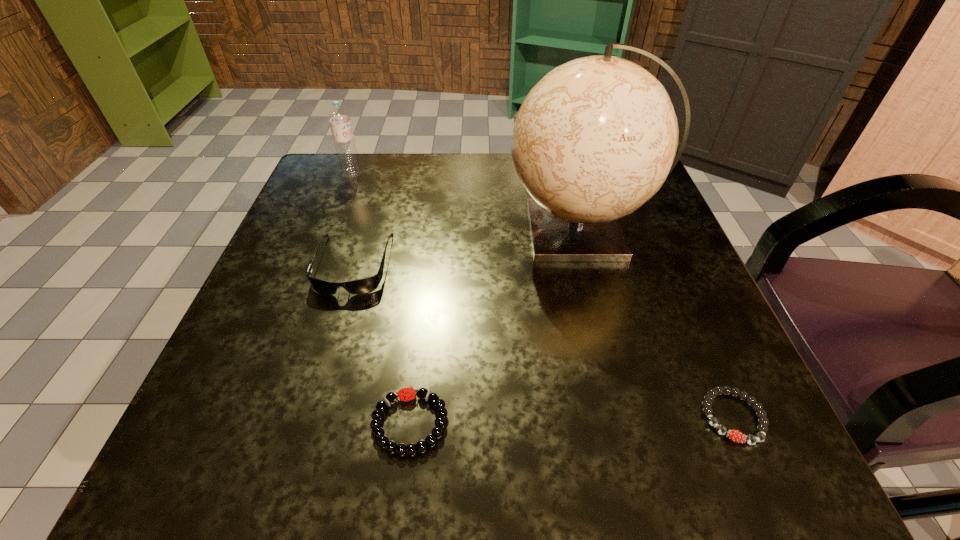
The width and height of the screenshot is (960, 540). Identify the location of object that stands as the third closest to the sunglasses. [596, 137].

Find the location of a particular element. The height and width of the screenshot is (540, 960). free space that satisfies the following two spatial constraints: 1. on the back side of the shortest object; 2. on the surface of the tallest object showing Europe and Africa is located at coordinates (652, 231).

This screenshot has height=540, width=960. Identify the location of vacant space that satisfies the following two spatial constraints: 1. on the front-facing side of the right bracelet; 2. on the right side of the sunglasses. (308, 417).

Find the location of a particular element. vacant space that satisfies the following two spatial constraints: 1. on the front-facing side of the sunglasses; 2. on the left side of the shortest object is located at coordinates (308, 417).

The width and height of the screenshot is (960, 540). I want to click on vacant space that satisfies the following two spatial constraints: 1. on the front-facing side of the taller bracelet; 2. on the right side of the sunglasses, so click(306, 423).

Image resolution: width=960 pixels, height=540 pixels. In order to click on vacant space that satisfies the following two spatial constraints: 1. on the front-facing side of the third tallest object; 2. on the right side of the third object from right to left in this screenshot , I will do `click(306, 423)`.

Find the location of a particular element. This screenshot has width=960, height=540. free spot that satisfies the following two spatial constraints: 1. on the front-facing side of the third object from right to left; 2. on the left side of the third tallest object is located at coordinates (306, 423).

Where is `vacant area that satisfies the following two spatial constraints: 1. on the front-facing side of the left bracelet; 2. on the right side of the third tallest object`? vacant area that satisfies the following two spatial constraints: 1. on the front-facing side of the left bracelet; 2. on the right side of the third tallest object is located at coordinates (306, 423).